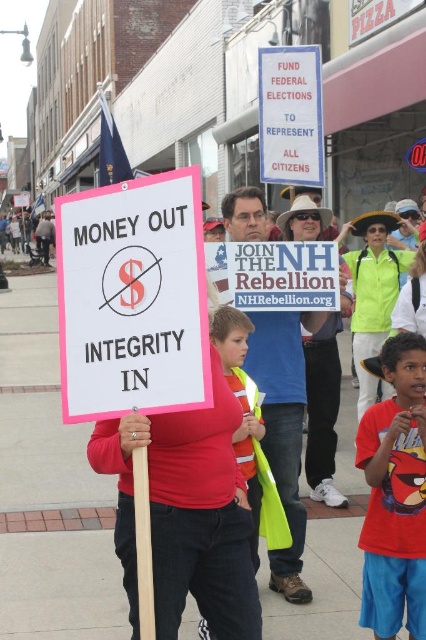
Does angry bird t-shirt at center come in front of blue denim jeans at center?

Yes, angry bird t-shirt at center is in front of blue denim jeans at center.

Who is more distant from viewer, (396, 355) or (290, 570)?

The point (290, 570) is more distant.

Locate an element on the screen. This screenshot has height=640, width=426. angry bird t-shirt at center is located at coordinates (394, 493).

Does pink plastic sign at center lie behind white paper sign at center?

No, it is in front of white paper sign at center.

Can you confirm if pink plastic sign at center is wider than white paper sign at center?

No, pink plastic sign at center is not wider than white paper sign at center.

The height and width of the screenshot is (640, 426). Describe the element at coordinates (132, 298) in the screenshot. I see `pink plastic sign at center` at that location.

Where is `pink plastic sign at center`? This screenshot has width=426, height=640. pink plastic sign at center is located at coordinates (132, 298).

What do you see at coordinates (132, 298) in the screenshot?
I see `pink plastic sign at center` at bounding box center [132, 298].

Which is in front, point (183, 182) or point (400, 506)?

Point (183, 182)

I want to click on pink plastic sign at center, so click(132, 298).